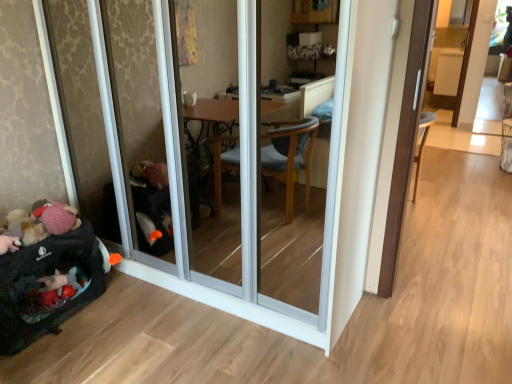
Question: From the image's perspective, is dark gray fabric baby carriage at lower left positioned above or below transparent glass screen door at left?

Choices:
 (A) above
 (B) below

Answer: (B)

Question: Is point (100, 244) positioned closer to the camera than point (240, 36)?

Choices:
 (A) farther
 (B) closer

Answer: (A)

Question: Based on their sizes in the image, would you say dark gray fabric baby carriage at lower left is bigger or smaller than transparent glass screen door at left?

Choices:
 (A) small
 (B) big

Answer: (A)

Question: Considering the positions of transparent glass screen door at left and dark gray fabric baby carriage at lower left in the image, is transparent glass screen door at left taller or shorter than dark gray fabric baby carriage at lower left?

Choices:
 (A) short
 (B) tall

Answer: (B)

Question: Visually, is transparent glass screen door at left positioned to the left or to the right of dark gray fabric baby carriage at lower left?

Choices:
 (A) left
 (B) right

Answer: (B)

Question: From a real-world perspective, is transparent glass screen door at left above or below dark gray fabric baby carriage at lower left?

Choices:
 (A) below
 (B) above

Answer: (B)

Question: Relative to dark gray fabric baby carriage at lower left, is transparent glass screen door at left in front or behind?

Choices:
 (A) behind
 (B) front

Answer: (B)